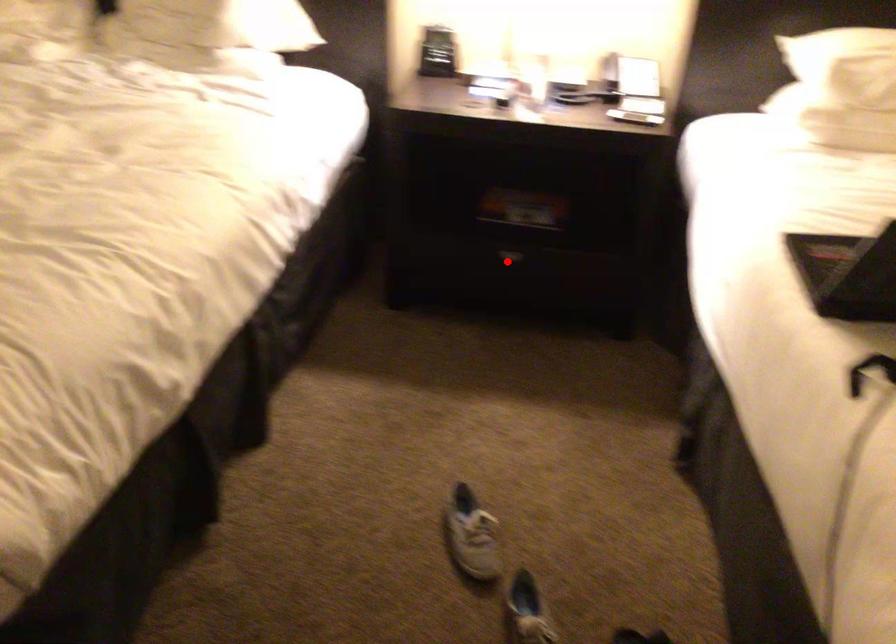
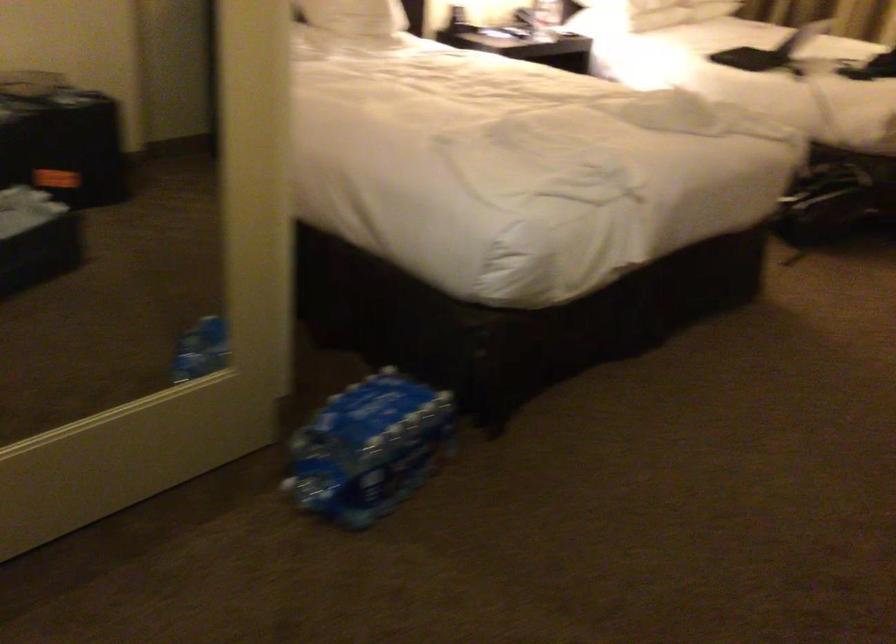
Question: I am providing you with two images of the same scene from different viewpoints. A red point is marked on the first image. Is the red point's position out of view in image 2?

Choices:
 (A) Yes
 (B) No

Answer: (A)